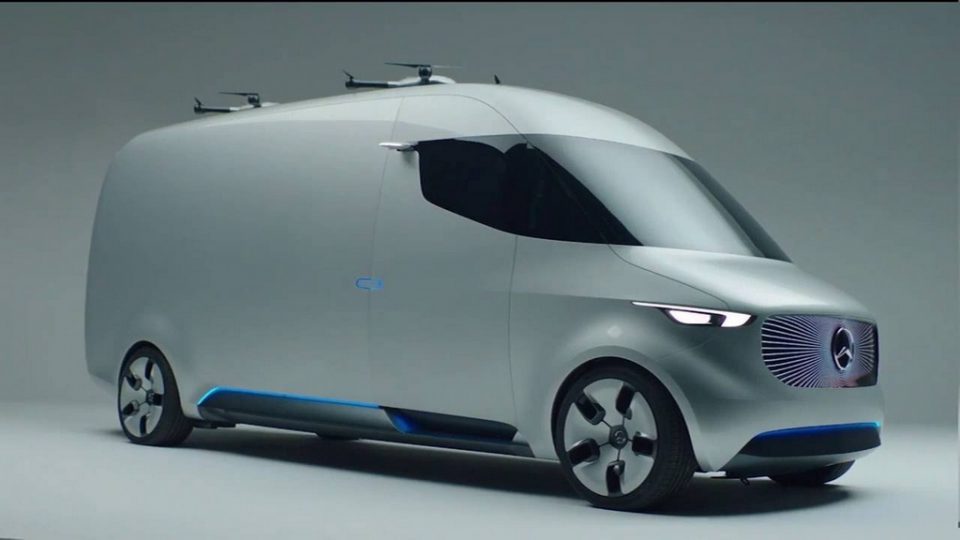
I want to click on floor, so click(x=216, y=518).